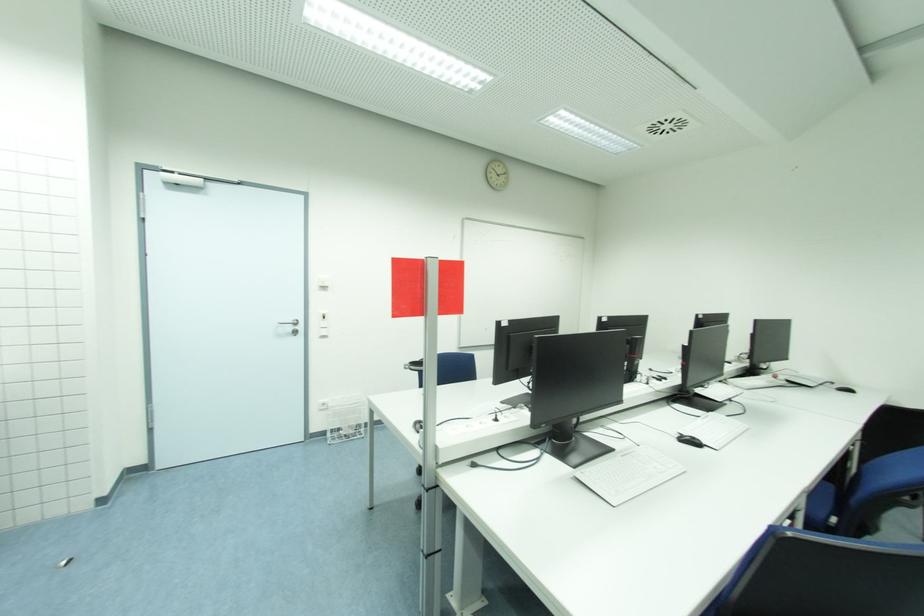
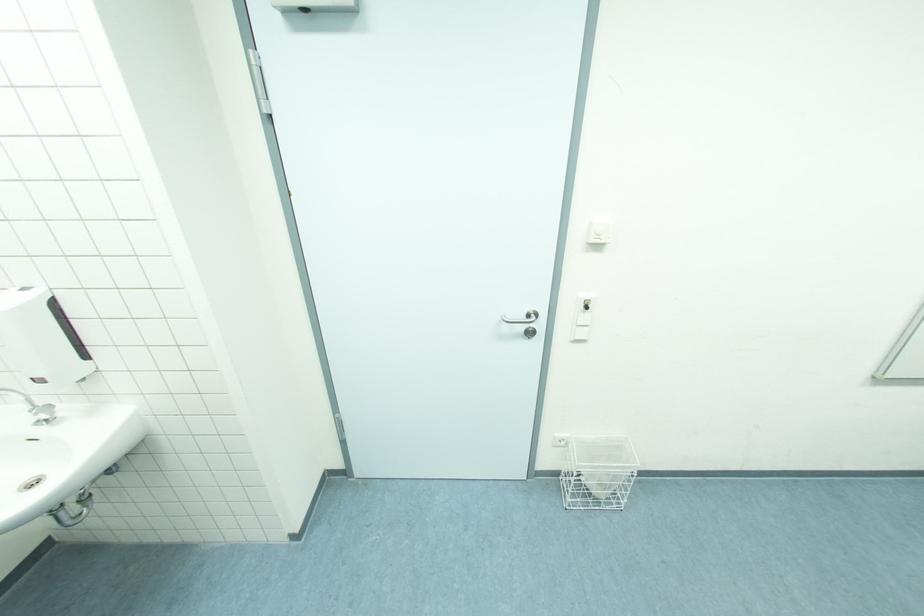
Where in the second image is the point corresponding to [298,334] from the first image?

(532, 334)